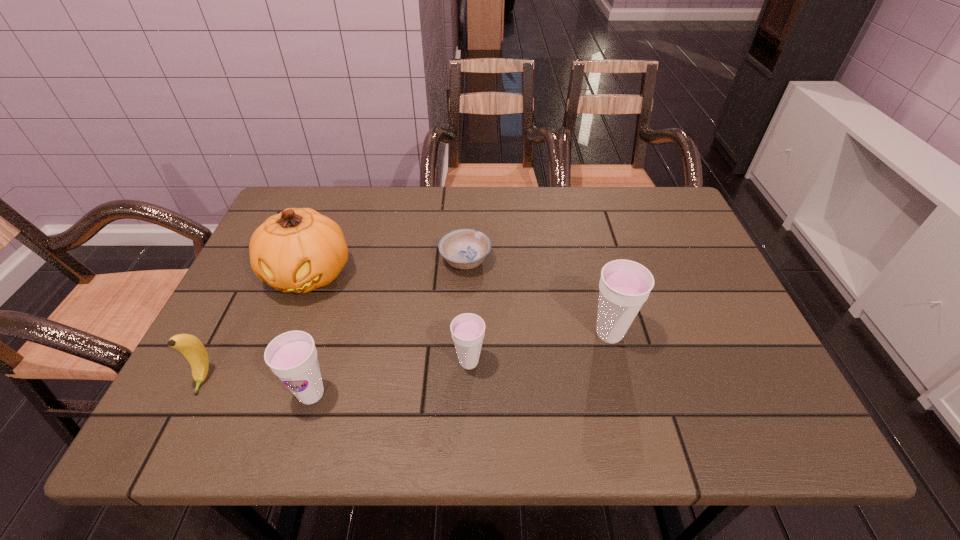
In the current image, all cups are evenly spaced. To maintain this equal spacing, where should an additional cup be placed on the right? Please point out a free spot. Please provide its 2D coordinates. Your answer should be formatted as a tuple, i.e. [(x, y)], where the tuple contains the x and y coordinates of a point satisfying the conditions above.

[(735, 308)]